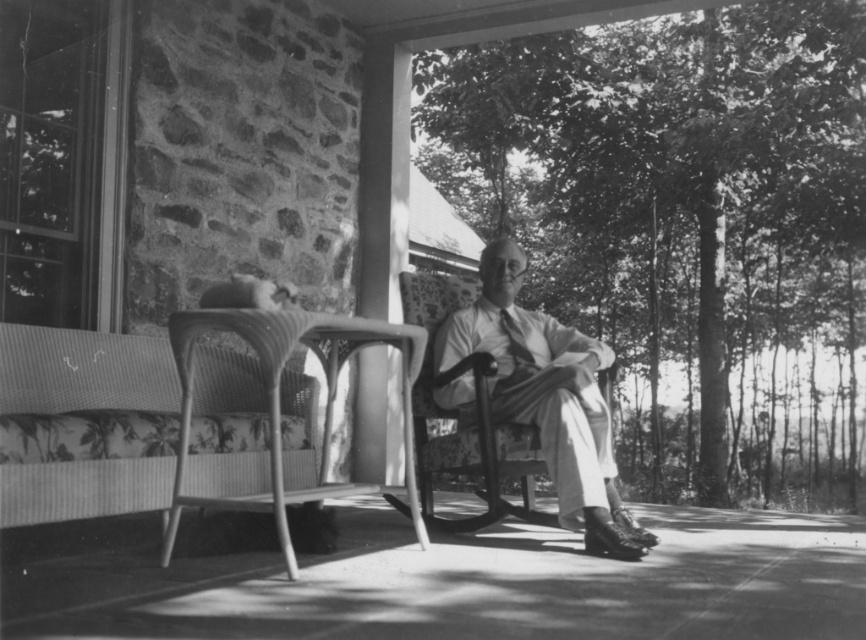
Based on the scene description, where is the woven fabric park bench at lower left located in the image?

The woven fabric park bench at lower left is located at point (x=83, y=424).

You are a guest at this outdoor gathering and need to choose seating. The woven fabric park bench at lower left and the light beige fabric chair at center are available. Based on their heights, which one would be more comfortable for someone who prefers a higher seat?

The light beige fabric chair at center is taller than the woven fabric park bench at lower left, so it would be more comfortable for someone who prefers a higher seat.